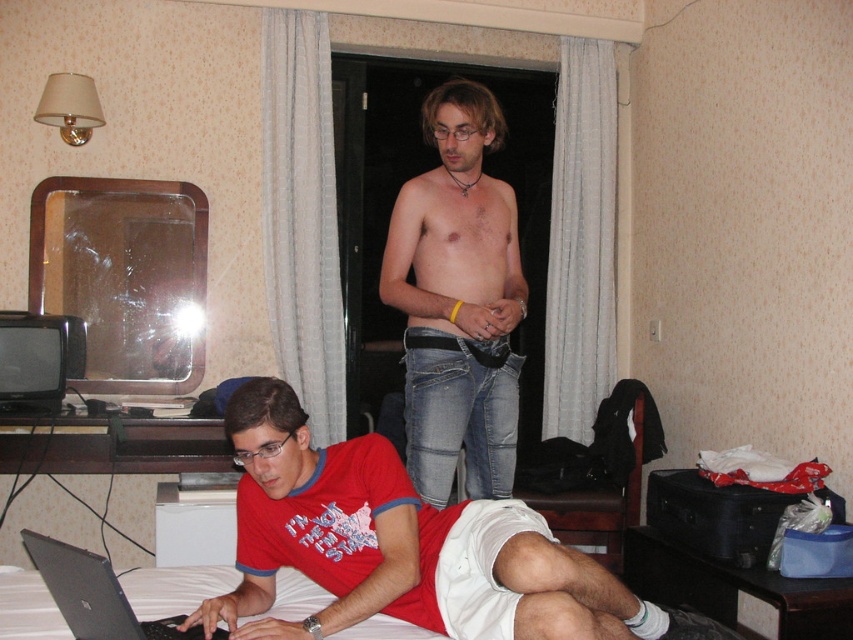
Question: Is red cotton t-shirt at lower left in front of silver metallic laptop at lower left?

Choices:
 (A) no
 (B) yes

Answer: (A)

Question: Considering the real-world distances, which object is closest to the denim jeans at center?

Choices:
 (A) silver metallic laptop at lower left
 (B) red cotton t-shirt at lower left

Answer: (B)

Question: Considering the real-world distances, which object is farthest from the red cotton t-shirt at lower left?

Choices:
 (A) denim jeans at center
 (B) silver metallic laptop at lower left

Answer: (A)

Question: Which point is closer to the camera taking this photo?

Choices:
 (A) (404, 259)
 (B) (485, 634)
 (C) (193, 636)

Answer: (B)

Question: Does denim jeans at center have a larger size compared to silver metallic laptop at lower left?

Choices:
 (A) yes
 (B) no

Answer: (A)

Question: Does red cotton t-shirt at lower left have a greater width compared to denim jeans at center?

Choices:
 (A) yes
 (B) no

Answer: (A)